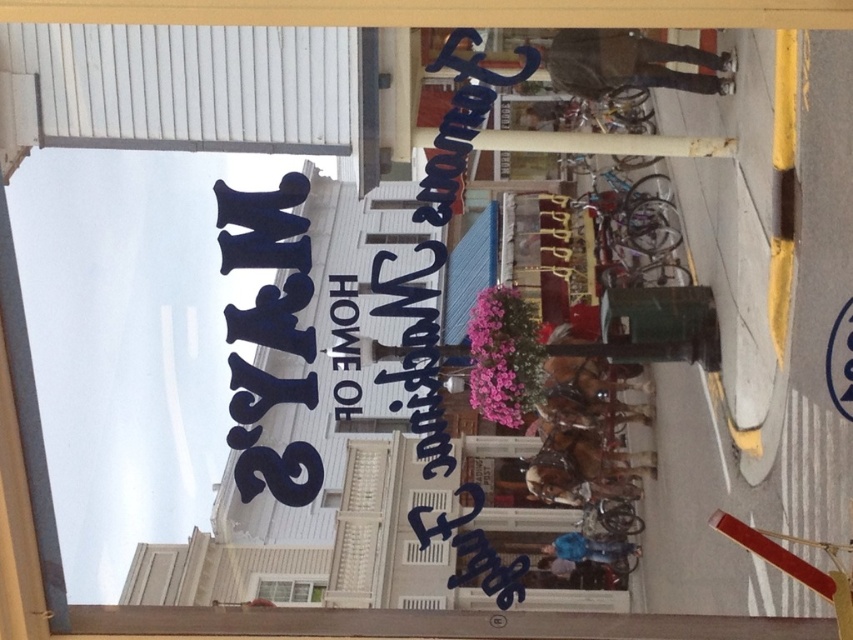
You are standing inside a building looking out through a window at a street scene. There is a point located at coordinates (375,268) in the image. Based on the scene description, can you estimate how far this point is from you?

The point at (375,268) is 19.89 meters away from the viewer.

Consider the image. You are a delivery person trying to read the white paper sign at upper center and the white matte window at lower center from outside the building. Which object is taller?

The white paper sign at upper center is taller than the white matte window at lower center.

You are standing inside a building and looking through the window. You see the blue painted sign at upper left and the white matte window at lower center. Which object is closer to you?

The blue painted sign at upper left is closer to the viewer than the white matte window at lower center.